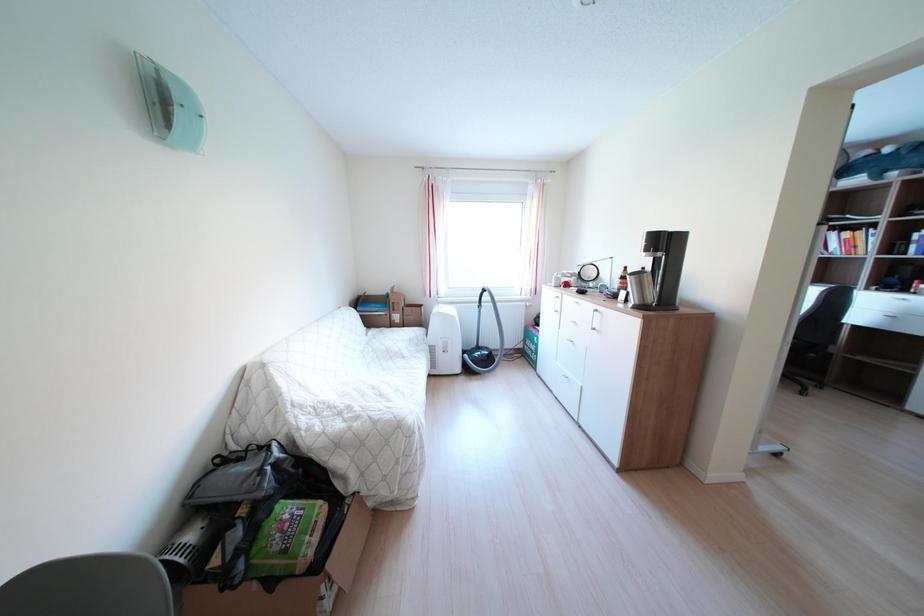
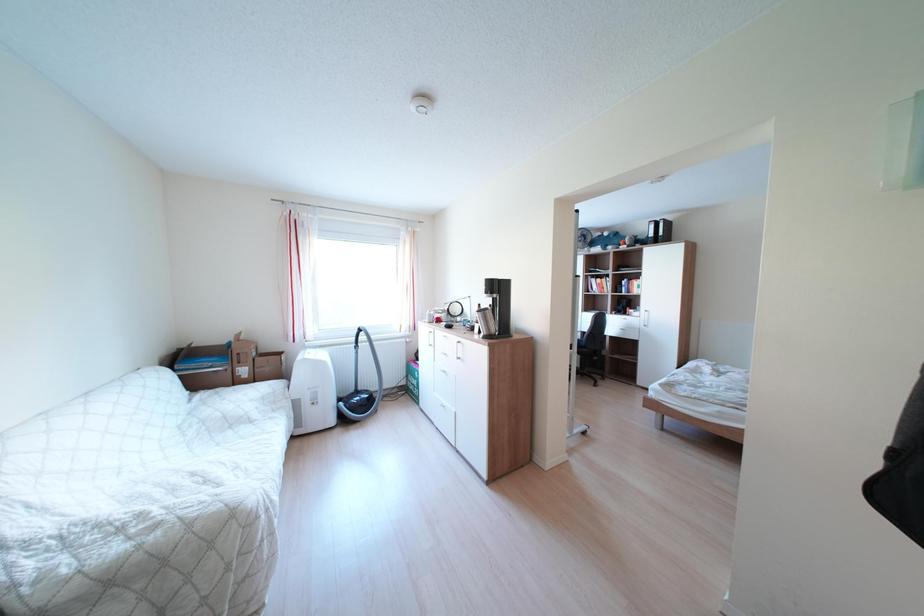
Which direction would the cameraman need to move to produce the second image?

The movement direction of the cameraman is right, backward.